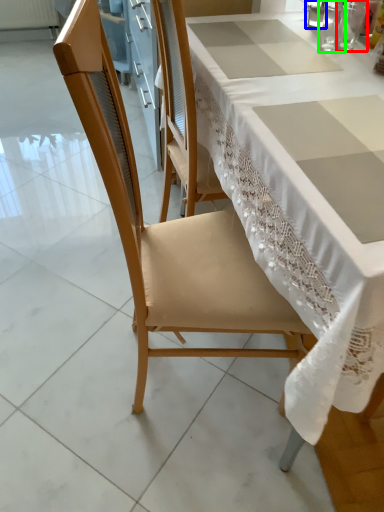
Question: Based on their relative distances, which object is farther from tableware (highlighted by a red box)? Choose from tableware (highlighted by a blue box) and tableware (highlighted by a green box).

Choices:
 (A) tableware
 (B) tableware

Answer: (A)